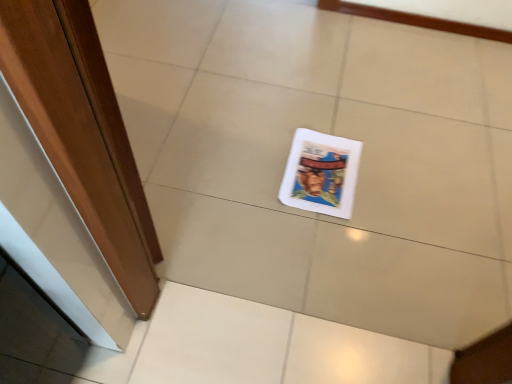
Where is `vacant space to the left of white glossy magazine at center`? This screenshot has width=512, height=384. vacant space to the left of white glossy magazine at center is located at coordinates (249, 170).